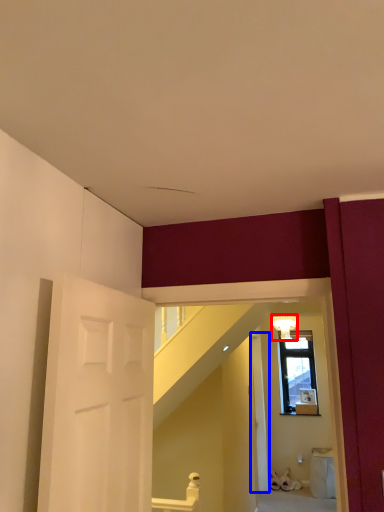
Question: Which object is closer to the camera taking this photo, light fixture (highlighted by a red box) or door (highlighted by a blue box)?

Choices:
 (A) light fixture
 (B) door

Answer: (B)